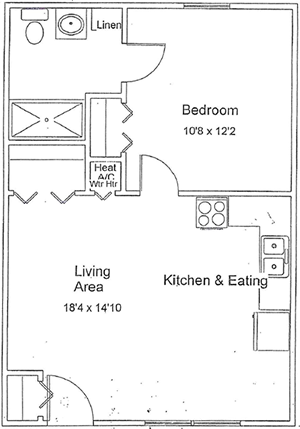
The height and width of the screenshot is (429, 300). What are the coordinates of `linen` in the screenshot? It's located at (101, 25).